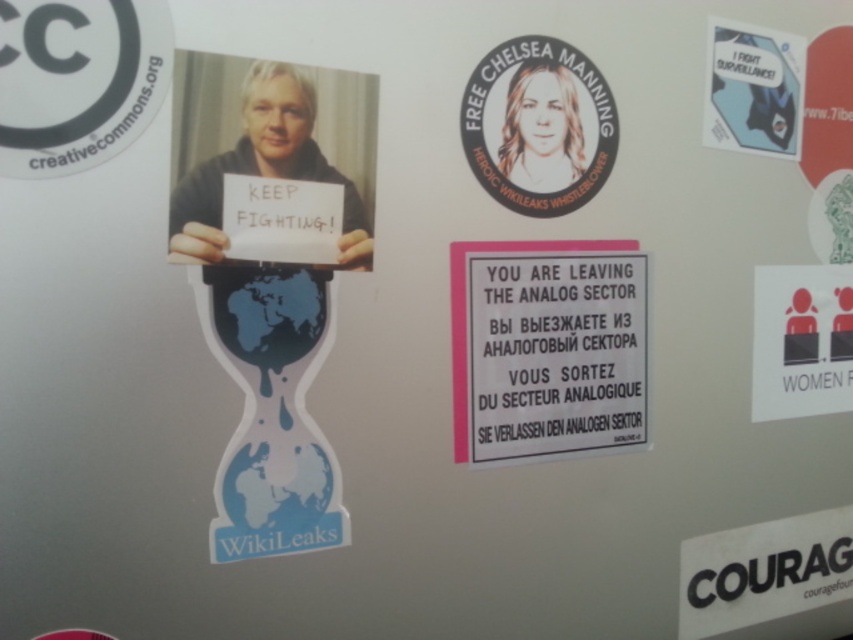
Based on the scene described, where is the white paper sign at right located in terms of its 2D coordinates?

The white paper sign at right is located at the 2D coordinates point (801, 340).

You are an activist organizing a protest and need to place a new sign on the board. The board already has a white paper sign at right and a blue glossy sticker at upper right. Where should you place the new sign so it doesn not overlap with existing items?

Place the new sign above the blue glossy sticker at upper right or to the left of the white paper sign at right to avoid overlapping with existing items.